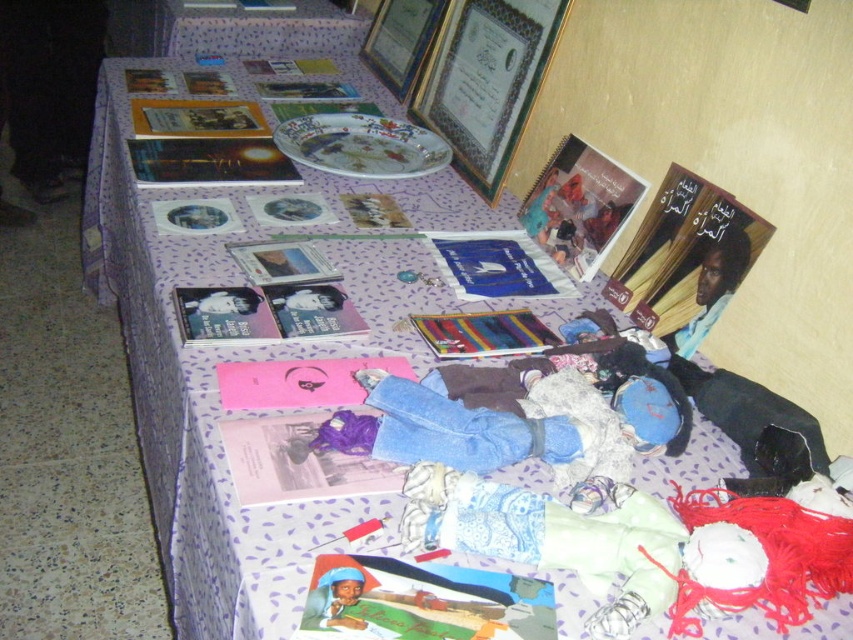
What is the 2D coordinate of the gold metallic picture frame at upper center?

The 2D coordinate of the gold metallic picture frame at upper center is at point (486,81).

Looking at the table display, which picture frame is positioned to the right when viewing the gold metallic picture frame at upper center and the wooden picture frame at upper center?

The gold metallic picture frame at upper center is to the right of the wooden picture frame at upper center.

You are standing at the point marked as point (502, 36) on the table. You need to place two framed certificates against the wall at the back of the table. The certificates must be placed exactly 1.52 meters apart. Can you determine if there is enough space between them to maintain this distance?

The two framed certificates are 1.52 meters apart, so yes, there is enough space between them to maintain the required distance of 1.52 meters.